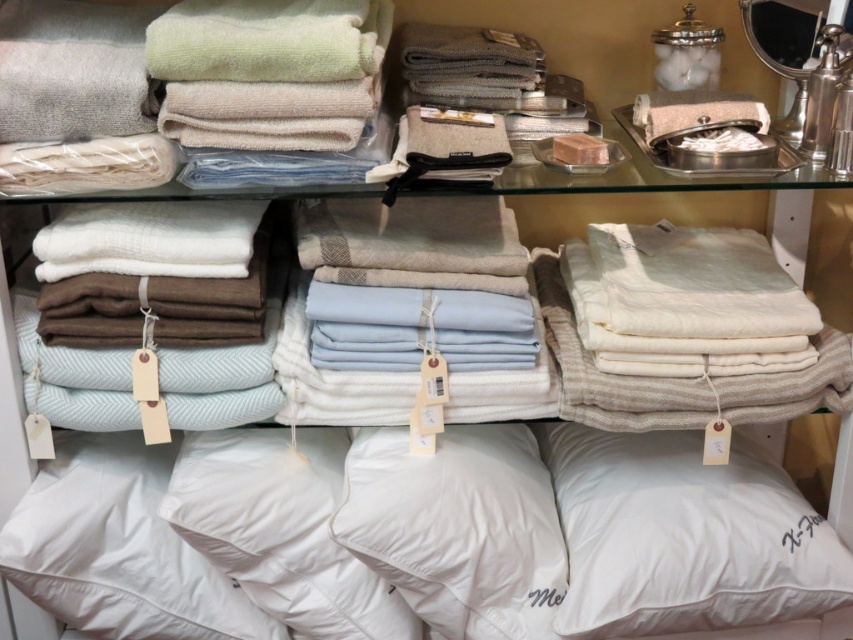
In the scene shown: You are a customer in a store looking at the textiles displayed on the shelves. You see a point marked at coordinates (683, 536). Which object does this point correspond to?

The point at coordinates (683, 536) corresponds to the white soft pillow at lower right.

You are a customer in a retail store looking at the display of textiles. You see the white cotton pillow at lower center. Can you determine its position relative to the other items on the shelf?

The white cotton pillow at lower center is located at point coordinates of [119,548], which places it near the bottom right of the shelf.